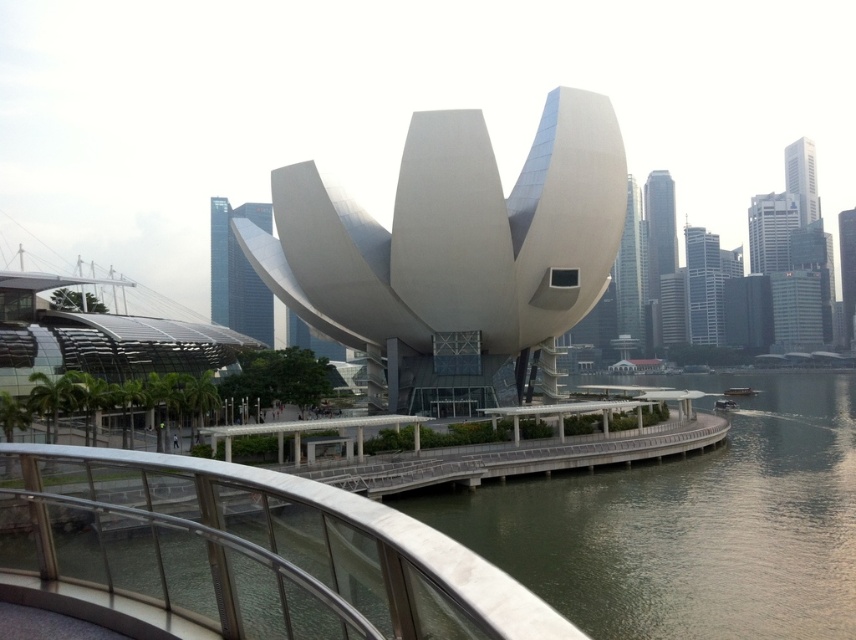
Question: Which of the following is the closest to the observer?

Choices:
 (A) white smooth building at center
 (B) metallic gray bridge at center
 (C) silver metallic bridge at lower center

Answer: (C)

Question: Can you confirm if white smooth building at center is positioned above metallic gray bridge at center?

Choices:
 (A) yes
 (B) no

Answer: (A)

Question: Considering the relative positions of white smooth building at center and metallic gray bridge at center in the image provided, where is white smooth building at center located with respect to metallic gray bridge at center?

Choices:
 (A) above
 (B) below

Answer: (A)

Question: Does white smooth building at center appear over silver metallic bridge at lower center?

Choices:
 (A) no
 (B) yes

Answer: (B)

Question: Which point appears closest to the camera in this image?

Choices:
 (A) click(522, 449)
 (B) click(533, 355)
 (C) click(215, 493)

Answer: (C)

Question: Which of the following is the farthest from the observer?

Choices:
 (A) metallic gray bridge at center
 (B) silver metallic bridge at lower center
 (C) white smooth building at center

Answer: (C)